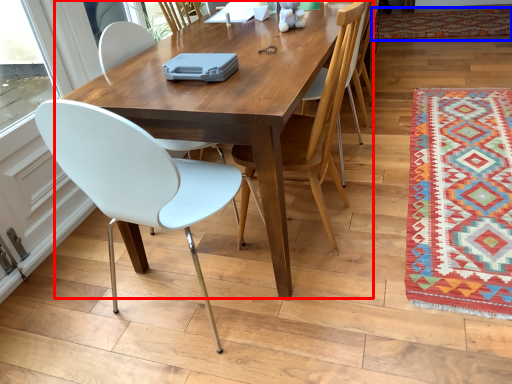
Question: Which of the following is the closest to the observer, kitchen & dining room table (highlighted by a red box) or mat (highlighted by a blue box)?

Choices:
 (A) kitchen & dining room table
 (B) mat

Answer: (A)